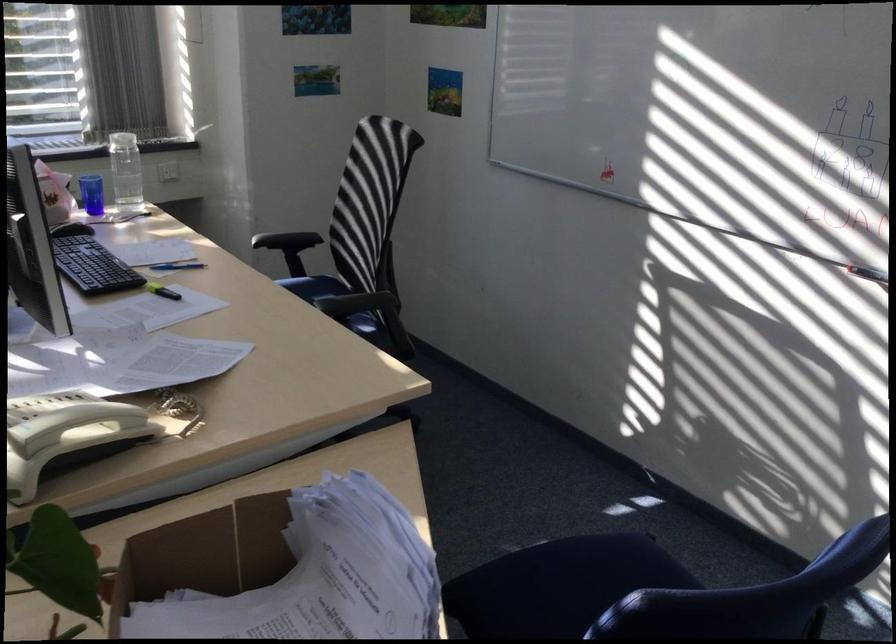
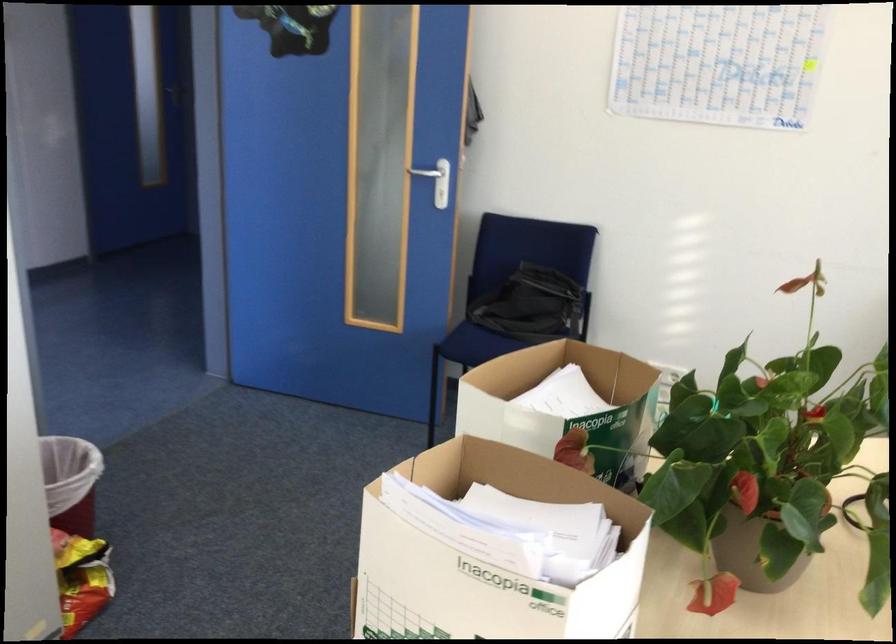
Locate, in the second image, the point that corresponds to point (257, 507) in the first image.

(489, 558)